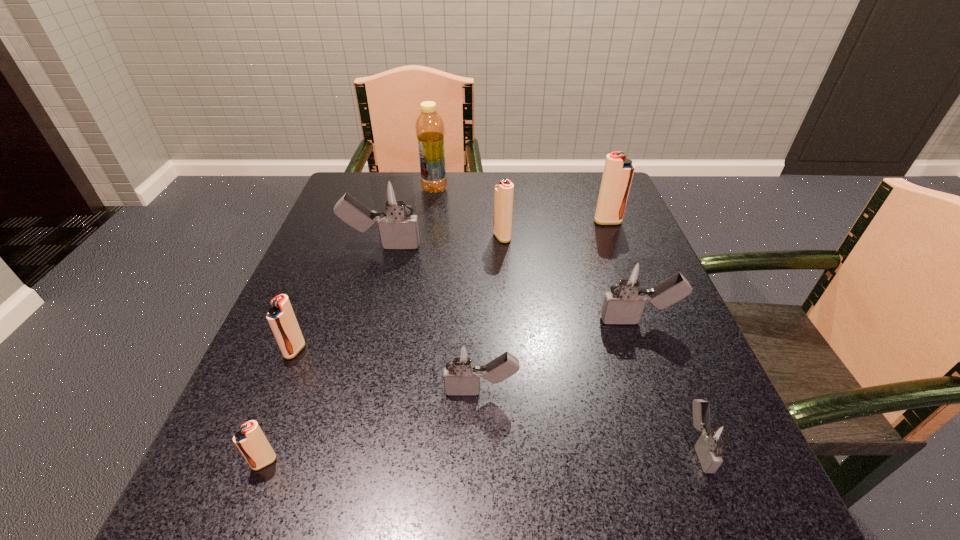
Where is `unoccupied position between the fifth farthest igniter and the farthest object`? The width and height of the screenshot is (960, 540). unoccupied position between the fifth farthest igniter and the farthest object is located at coordinates (365, 269).

Locate an element on the screen. This screenshot has width=960, height=540. free space that is in between the second nearest gray igniter and the third nearest red igniter is located at coordinates (492, 314).

Image resolution: width=960 pixels, height=540 pixels. I want to click on blank region between the farthest object and the smallest red igniter, so (349, 326).

Locate an element on the screen. This screenshot has width=960, height=540. free spot between the tallest object and the biggest red igniter is located at coordinates (521, 205).

Locate an element on the screen. object that stands as the closest to the bottle is located at coordinates (394, 195).

This screenshot has width=960, height=540. What are the coordinates of `object identified as the fifth closest to the third farthest red igniter` in the screenshot? It's located at (430, 132).

The height and width of the screenshot is (540, 960). I want to click on the fifth closest igniter to the third nearest red igniter, so click(281, 318).

Select which igniter appears as the third closest to the fourth nearest igniter. Please provide its 2D coordinates. Your answer should be formatted as a tuple, i.e. [(x, y)], where the tuple contains the x and y coordinates of a point satisfying the conditions above.

[(462, 366)]

Identify the location of red igniter that is the third nearest to the smallest red igniter. The height and width of the screenshot is (540, 960). (618, 172).

Locate which red igniter ranks in proximity to the farthest igniter. Please provide its 2D coordinates. Your answer should be formatted as a tuple, i.e. [(x, y)], where the tuple contains the x and y coordinates of a point satisfying the conditions above.

[(503, 192)]